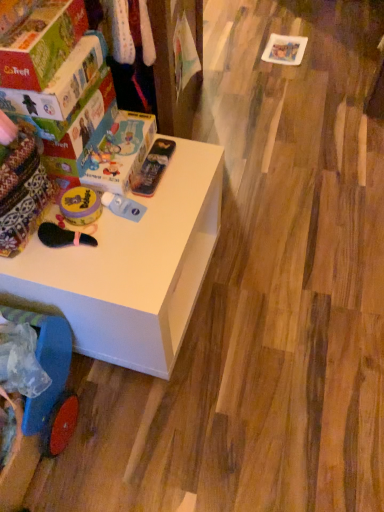
What are the coordinates of `free space in front of metallic blue pencil case at upper center, which is the 1th toy in right-to-left order` in the screenshot? It's located at (157, 217).